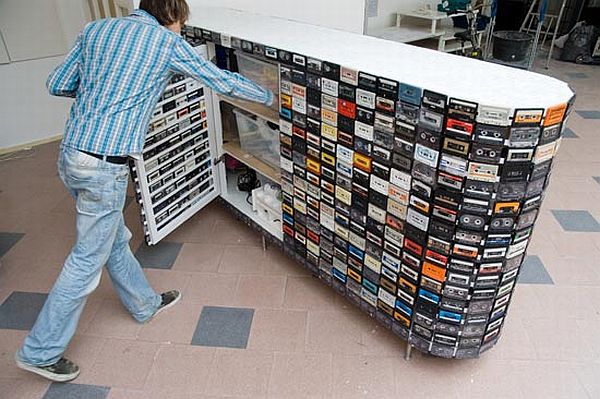
At what (x,y) coordinates should I click in order to perform the action: click on tile floor. Please return your answer as a coordinate pair (x, y). This screenshot has height=399, width=600. Looking at the image, I should click on (304, 360).